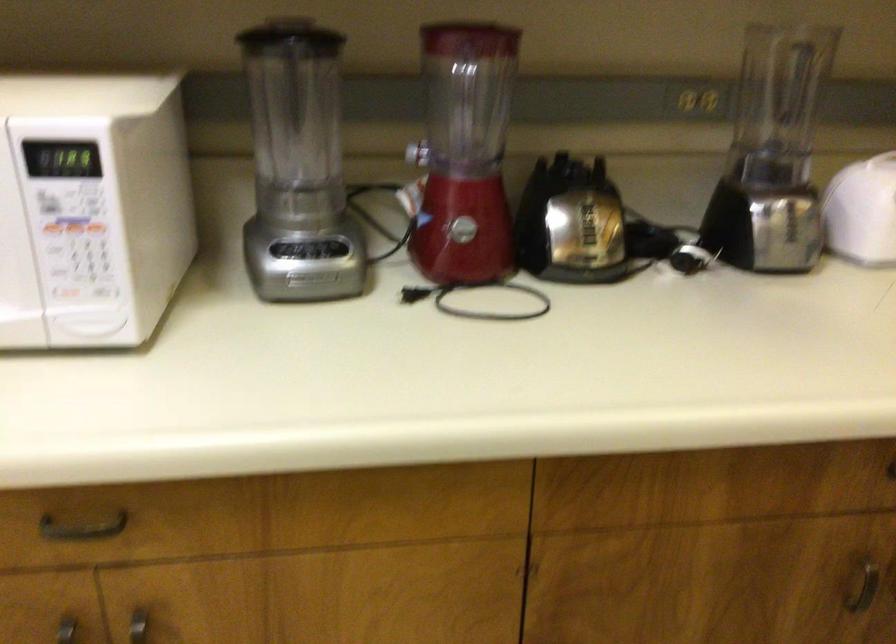
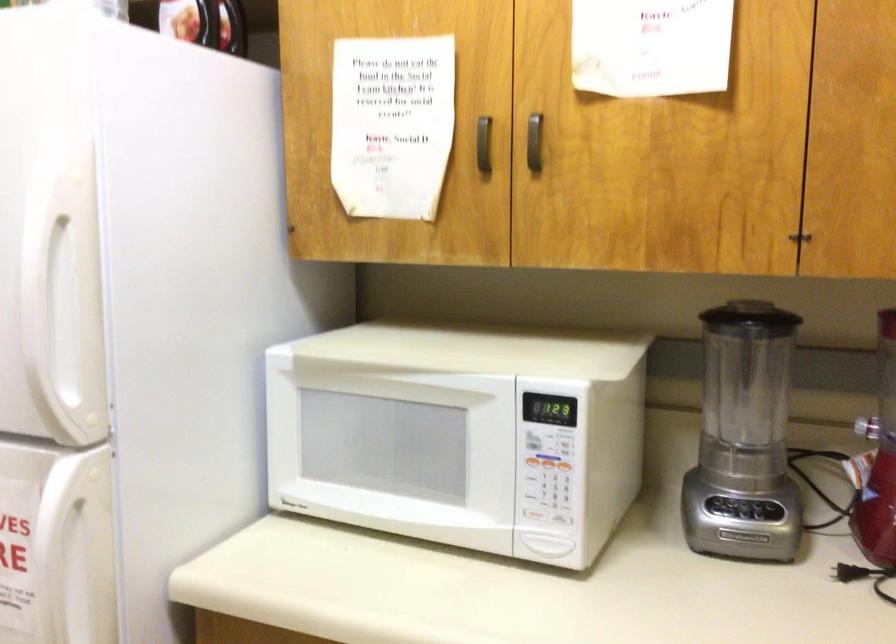
The point at (307,278) is marked in the first image. Where is the corresponding point in the second image?

(743, 536)